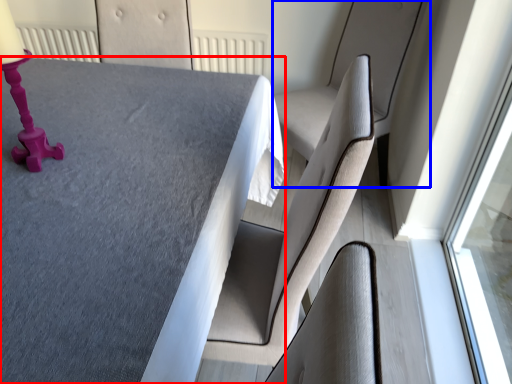
Question: Among these objects, which one is farthest to the camera, table (highlighted by a red box) or swivel chair (highlighted by a blue box)?

Choices:
 (A) table
 (B) swivel chair

Answer: (B)